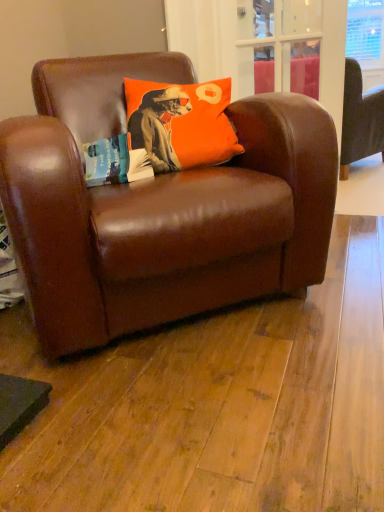
Find the location of a particular element. orange matte pillow at upper center is located at coordinates pos(181,123).

From a real-world perspective, which is physically below, brown leather chair at center or orange matte pillow at upper center?

brown leather chair at center.

Does point (176, 221) come behind point (145, 100)?

No, (176, 221) is in front of (145, 100).

Can you confirm if brown leather chair at center is positioned to the left of orange matte pillow at upper center?

Correct, you'll find brown leather chair at center to the left of orange matte pillow at upper center.

Does brown leather chair at center lie behind orange matte pillow at upper center?

No, brown leather chair at center is closer to the camera.

Does point (372, 118) lie behind point (328, 239)?

Yes, point (372, 118) is behind point (328, 239).

How different are the orientations of brown leather couch at upper right and brown leather chair at center in degrees?

The angular difference between brown leather couch at upper right and brown leather chair at center is 108 degrees.

Based on their sizes in the image, would you say brown leather couch at upper right is bigger or smaller than brown leather chair at center?

Clearly, brown leather couch at upper right is larger in size than brown leather chair at center.

Considering the relative positions of brown leather couch at upper right and brown leather chair at center in the image provided, is brown leather couch at upper right behind brown leather chair at center?

Yes, brown leather couch at upper right is further from the viewer.

From the picture: From the image's perspective, which is below, orange matte pillow at upper center or brown leather couch at upper right?

From the image's view, orange matte pillow at upper center is below.

Find the location of a particular element. The width and height of the screenshot is (384, 512). studio couch lying behind the orange matte pillow at upper center is located at coordinates (360, 120).

Between orange matte pillow at upper center and brown leather couch at upper right, which one has smaller size?

With smaller size is orange matte pillow at upper center.

Is brown leather chair at center facing away from brown leather couch at upper right?

No, brown leather couch at upper right is not at the back of brown leather chair at center.

Can you confirm if brown leather chair at center is positioned to the left of brown leather couch at upper right?

Indeed, brown leather chair at center is positioned on the left side of brown leather couch at upper right.

Is brown leather chair at center taller or shorter than brown leather couch at upper right?

In the image, brown leather chair at center appears to be shorter than brown leather couch at upper right.

In the scene shown: Does brown leather couch at upper right contain orange matte pillow at upper center?

That's incorrect, orange matte pillow at upper center is not inside brown leather couch at upper right.

Considering the relative sizes of brown leather couch at upper right and orange matte pillow at upper center in the image provided, is brown leather couch at upper right taller than orange matte pillow at upper center?

Correct, brown leather couch at upper right is much taller as orange matte pillow at upper center.

Considering the sizes of objects brown leather couch at upper right and orange matte pillow at upper center in the image provided, who is wider, brown leather couch at upper right or orange matte pillow at upper center?

With larger width is brown leather couch at upper right.

Considering the positions of objects orange matte pillow at upper center and brown leather chair at center in the image provided, who is behind, orange matte pillow at upper center or brown leather chair at center?

Positioned behind is orange matte pillow at upper center.

Is orange matte pillow at upper center looking in the opposite direction of brown leather chair at center?

Yes, brown leather chair at center is at the back of orange matte pillow at upper center.

Consider the image. Is orange matte pillow at upper center bigger than brown leather chair at center?

Actually, orange matte pillow at upper center might be smaller than brown leather chair at center.

Where is `pillow that appears on the right of brown leather chair at center`? The width and height of the screenshot is (384, 512). pillow that appears on the right of brown leather chair at center is located at coordinates (181, 123).

Locate an element on the screen. studio couch above the brown leather chair at center (from a real-world perspective) is located at coordinates (360, 120).

Looking at this image, considering their positions, is orange matte pillow at upper center positioned closer to brown leather chair at center than brown leather couch at upper right?

Among the two, orange matte pillow at upper center is located nearer to brown leather chair at center.

Which object lies further to the anchor point brown leather couch at upper right, orange matte pillow at upper center or brown leather chair at center?

brown leather chair at center is further to brown leather couch at upper right.

Estimate the real-world distances between objects in this image. Which object is further from orange matte pillow at upper center, brown leather couch at upper right or brown leather chair at center?

The object further to orange matte pillow at upper center is brown leather couch at upper right.

Looking at the image, which one is located closer to brown leather chair at center, brown leather couch at upper right or orange matte pillow at upper center?

orange matte pillow at upper center is closer to brown leather chair at center.

From the image, which object appears to be farther from orange matte pillow at upper center, brown leather chair at center or brown leather couch at upper right?

brown leather couch at upper right.

Estimate the real-world distances between objects in this image. Which object is closer to brown leather couch at upper right, brown leather chair at center or orange matte pillow at upper center?

The object closer to brown leather couch at upper right is orange matte pillow at upper center.

The width and height of the screenshot is (384, 512). Identify the location of pillow positioned between brown leather chair at center and brown leather couch at upper right from near to far. (181, 123).